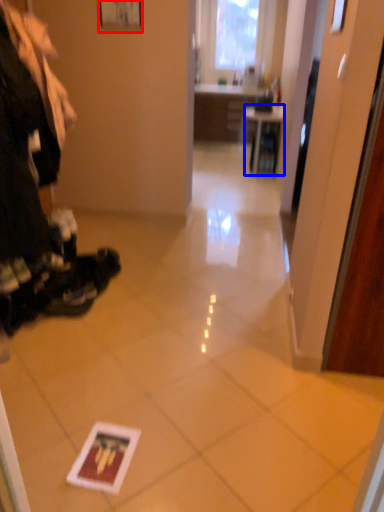
Question: Which object is further to the camera taking this photo, picture frame (highlighted by a red box) or table (highlighted by a blue box)?

Choices:
 (A) picture frame
 (B) table

Answer: (B)